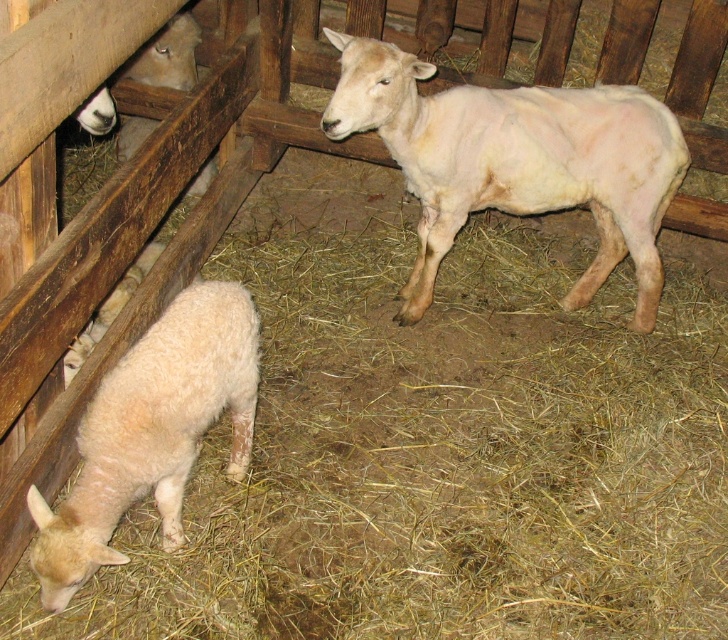
You are a farmer checking on your sheep in the barn. You notice the white woolen sheep at center and the white woolen lamb at lower left. Which one is closer to you?

The white woolen sheep at center is closer to you because it is further to the viewer than the white woolen lamb at lower left.

You are a farmer checking the sheep in the barn. You notice the white woolen sheep at center and the white woolen lamb at lower left. Which one is bigger?

The white woolen sheep at center is larger in size than the white woolen lamb at lower left.